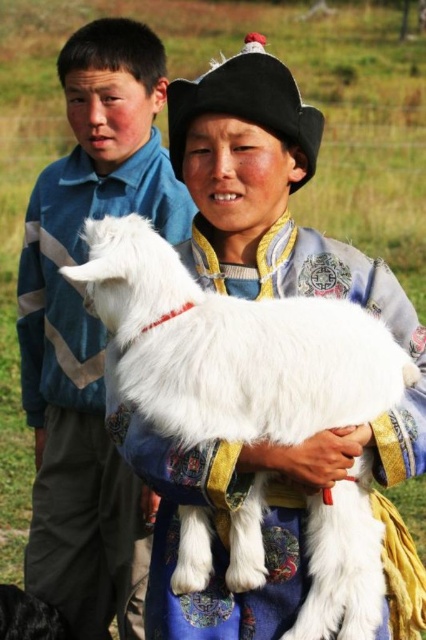
Question: Does fluffy white lamb at center appear over matte blue shirt at center?

Choices:
 (A) no
 (B) yes

Answer: (B)

Question: In this image, where is fluffy white lamb at center located relative to matte blue shirt at center?

Choices:
 (A) right
 (B) left

Answer: (A)

Question: Which point is farther from the camera taking this photo?

Choices:
 (A) (94, 172)
 (B) (376, 376)

Answer: (A)

Question: Does fluffy white lamb at center appear over matte blue shirt at center?

Choices:
 (A) yes
 (B) no

Answer: (A)